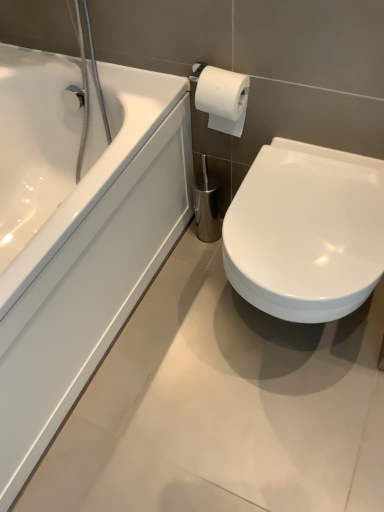
What are the coordinates of `vacant region under white glossy toilet at lower right (from a real-world perspective)` in the screenshot? It's located at click(x=279, y=340).